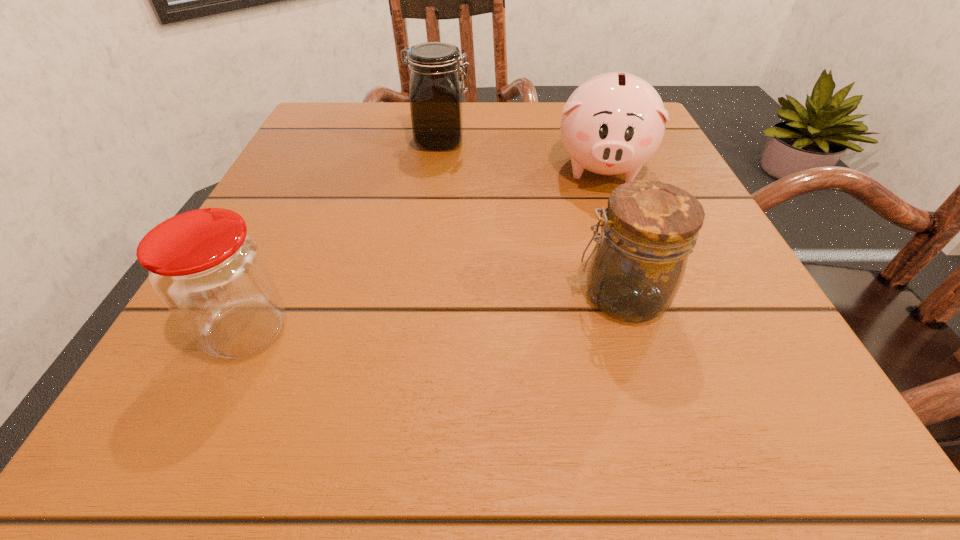
Identify which object is the second closest to the rightmost jar. Please provide its 2D coordinates. Your answer should be formatted as a tuple, i.e. [(x, y)], where the tuple contains the x and y coordinates of a point satisfying the conditions above.

[(436, 89)]

The image size is (960, 540). Identify the location of the second closest object to the rightmost jar. [x=436, y=89].

I want to click on jar that is the second closest to the farthest jar, so click(x=211, y=274).

You are a GUI agent. You are given a task and a screenshot of the screen. Output one action in this format:
    pyautogui.click(x=<x>, y=<y>)
    Task: Click on the jar that is the second closest to the farthest jar
    The image size is (960, 540).
    Given the screenshot: What is the action you would take?
    pyautogui.click(x=211, y=274)

Where is `vacant space that satisfies the following two spatial constraints: 1. on the front side of the piggy bank; 2. on the lid of the rightmost jar`? The image size is (960, 540). vacant space that satisfies the following two spatial constraints: 1. on the front side of the piggy bank; 2. on the lid of the rightmost jar is located at coordinates (648, 296).

Locate an element on the screen. The height and width of the screenshot is (540, 960). vacant space that satisfies the following two spatial constraints: 1. on the lid of the third object from right to left; 2. on the back side of the piggy bank is located at coordinates (437, 167).

Locate an element on the screen. The image size is (960, 540). vacant space that satisfies the following two spatial constraints: 1. on the lid of the farthest jar; 2. on the back side of the piggy bank is located at coordinates (437, 167).